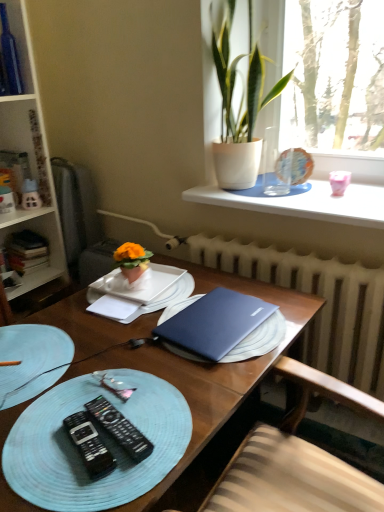
Identify the location of free area in between matte orange flowerpot at center, the first houseplant from the left, and black plastic remote control at lower left, acting as the second remote control starting from the right. Image resolution: width=384 pixels, height=512 pixels. (114, 358).